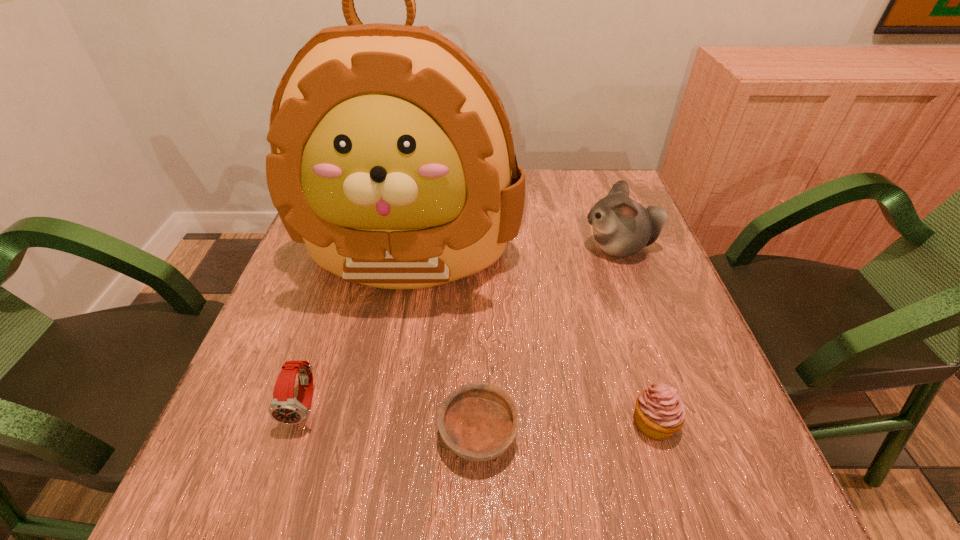
The width and height of the screenshot is (960, 540). Identify the location of backpack. (392, 158).

The width and height of the screenshot is (960, 540). Identify the location of hamster. (622, 227).

Locate an element on the screen. This screenshot has width=960, height=540. watch is located at coordinates (284, 408).

Identify the location of cupcake. (660, 412).

Image resolution: width=960 pixels, height=540 pixels. In order to click on the shortest object in this screenshot , I will do `click(477, 421)`.

Identify the location of blank space located 0.270m on the front-facing side of the backpack. (375, 440).

Image resolution: width=960 pixels, height=540 pixels. In order to click on vacant region located 0.320m on the face of the second tallest object in this screenshot , I will do `click(450, 247)`.

You are a GUI agent. You are given a task and a screenshot of the screen. Output one action in this format:
    pyautogui.click(x=<x>, y=<y>)
    Task: Click on the free location located on the face of the second tallest object
    Image resolution: width=960 pixels, height=540 pixels.
    Given the screenshot: What is the action you would take?
    pyautogui.click(x=483, y=247)

Where is `vacant space located on the face of the second tallest object`? The image size is (960, 540). vacant space located on the face of the second tallest object is located at coordinates (434, 247).

Find the location of a particular element. free spot located 0.120m on the face of the watch is located at coordinates (271, 510).